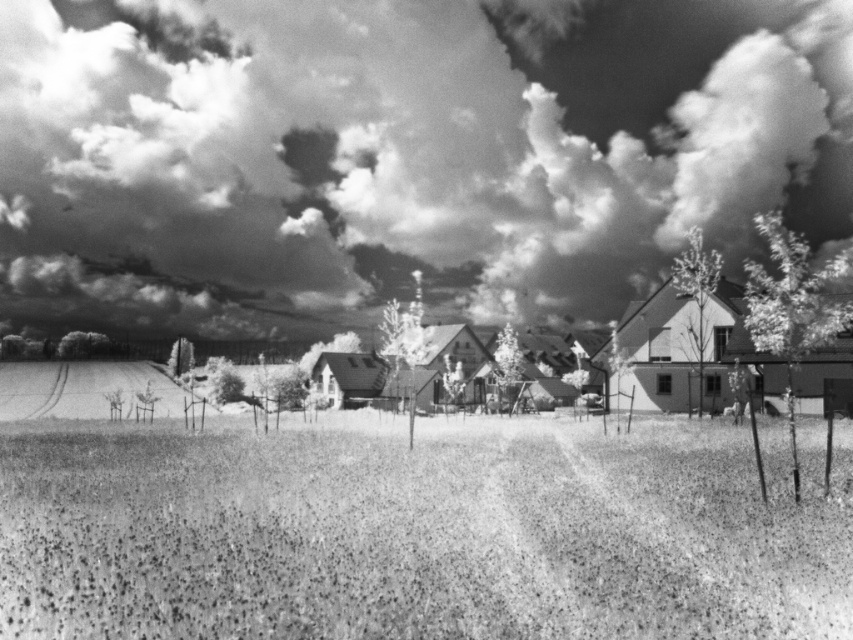
Question: Which point appears closest to the camera in this image?

Choices:
 (A) coord(376,445)
 (B) coord(527,40)

Answer: (A)

Question: Does cloudy sky at upper center have a greater width compared to grainy grass at center?

Choices:
 (A) yes
 (B) no

Answer: (A)

Question: Which of the following is the farthest from the observer?

Choices:
 (A) grainy grass at center
 (B) cloudy sky at upper center

Answer: (B)

Question: Is cloudy sky at upper center closer to camera compared to grainy grass at center?

Choices:
 (A) yes
 (B) no

Answer: (B)

Question: Observing the image, what is the correct spatial positioning of cloudy sky at upper center in reference to grainy grass at center?

Choices:
 (A) right
 (B) left

Answer: (A)